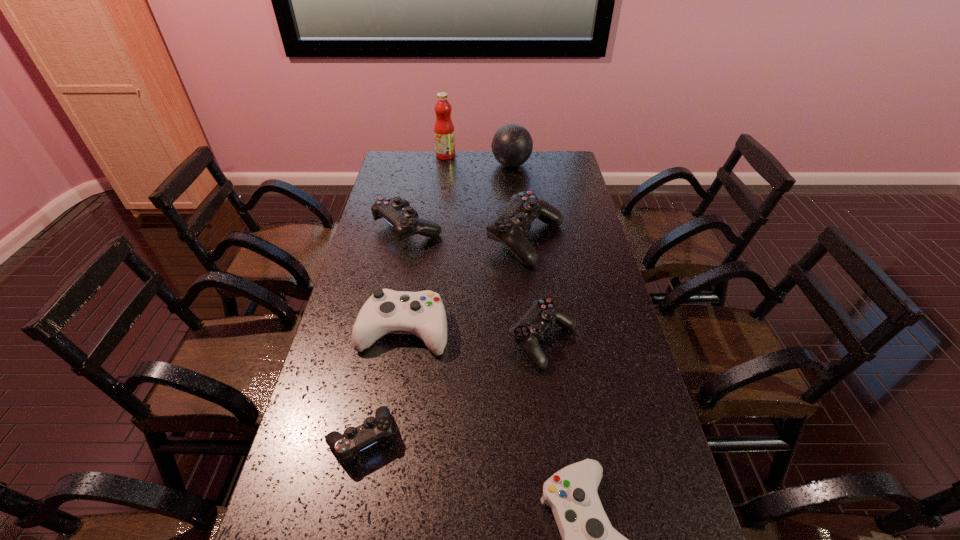
In order to click on the tallest object in this screenshot , I will do `click(444, 134)`.

The width and height of the screenshot is (960, 540). Identify the location of pink fruit juice. (444, 134).

Locate an element on the screen. This screenshot has height=540, width=960. the second tallest object is located at coordinates (512, 145).

Locate an element on the screen. the sixth shortest object is located at coordinates (509, 227).

Where is `the tallest control`? The width and height of the screenshot is (960, 540). the tallest control is located at coordinates (509, 227).

Where is `the second biggest black control`? The width and height of the screenshot is (960, 540). the second biggest black control is located at coordinates (397, 212).

This screenshot has height=540, width=960. Find the location of `the farther white control`. the farther white control is located at coordinates (422, 313).

The height and width of the screenshot is (540, 960). I want to click on the bigger white control, so click(422, 313).

Where is `the second nearest black control`? the second nearest black control is located at coordinates (531, 328).

The height and width of the screenshot is (540, 960). I want to click on the shortest object, so click(x=374, y=429).